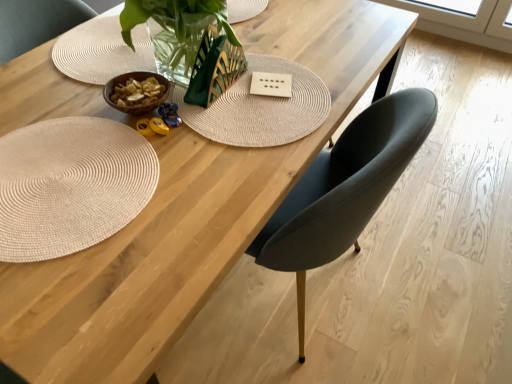
Locate an element on the screen. vacant area in front of white matte card at center is located at coordinates (262, 130).